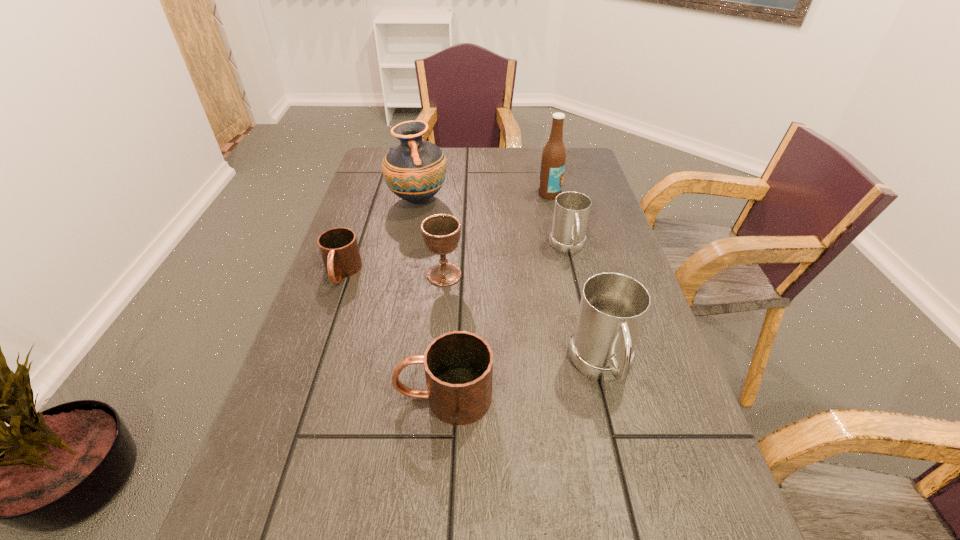
I want to click on vacant area that lies between the chalice and the tallest mug, so click(523, 321).

Point out which object is positioned as the third nearest to the beer bottle. Please provide its 2D coordinates. Your answer should be formatted as a tuple, i.e. [(x, y)], where the tuple contains the x and y coordinates of a point satisfying the conditions above.

[(441, 233)]

Locate which object is the fourth closest to the smaller rust mug. Please provide its 2D coordinates. Your answer should be formatted as a tuple, i.e. [(x, y)], where the tuple contains the x and y coordinates of a point satisfying the conditions above.

[(571, 213)]

The image size is (960, 540). What are the coordinates of `mug that stands as the third closest to the chalice` in the screenshot? It's located at (458, 365).

This screenshot has height=540, width=960. I want to click on the third closest mug to the beer bottle, so click(x=339, y=250).

Where is `free space that satisfies the following two spatial constraints: 1. on the side of the smaller rust mug with the handle; 2. on the right side of the chalice`? free space that satisfies the following two spatial constraints: 1. on the side of the smaller rust mug with the handle; 2. on the right side of the chalice is located at coordinates (341, 275).